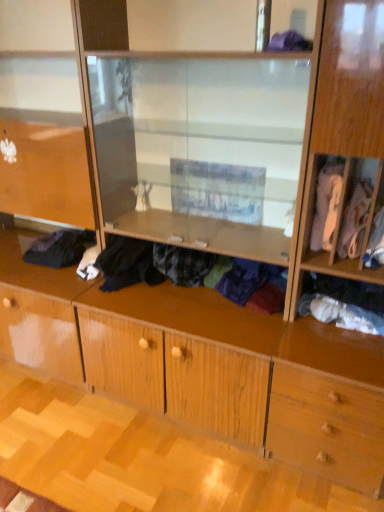
Question: Considering the positions of white fabric at right, which is the fifth clothing from left to right, and black fabric at lower left, which appears as the 1th clothing when viewed from the left, in the image, is white fabric at right, which is the fifth clothing from left to right, bigger or smaller than black fabric at lower left, which appears as the 1th clothing when viewed from the left,?

Choices:
 (A) big
 (B) small

Answer: (B)

Question: Is white fabric at right, acting as the third clothing starting from the right, wider or thinner than black fabric at lower left, positioned as the 7th clothing in right-to-left order?

Choices:
 (A) wide
 (B) thin

Answer: (B)

Question: Estimate the real-world distances between objects in this image. Which object is farther from the purple fabric at upper center, the 5th clothing positioned from the right?

Choices:
 (A) white cotton shirt at right, the first clothing positioned from the right
 (B) dark blue fabric at center, marked as the sixth clothing in a right-to-left arrangement
 (C) white fabric at right, the 4th clothing from the right
 (D) white fabric at right, which is the fifth clothing from left to right
 (E) white fabric at lower right, which is counted as the 6th clothing, starting from the left

Answer: (B)

Question: Based on their relative distances, which object is farther from the white fabric at right, which ranks as the fourth clothing in left-to-right order?

Choices:
 (A) white fabric at lower right, which appears as the 2th clothing when viewed from the right
 (B) white fabric at right, which is the fifth clothing from left to right
 (C) dark blue fabric at center, the second clothing in the left-to-right sequence
 (D) white cotton shirt at right, the seventh clothing from the left
 (E) purple fabric at upper center, the 5th clothing positioned from the right

Answer: (E)